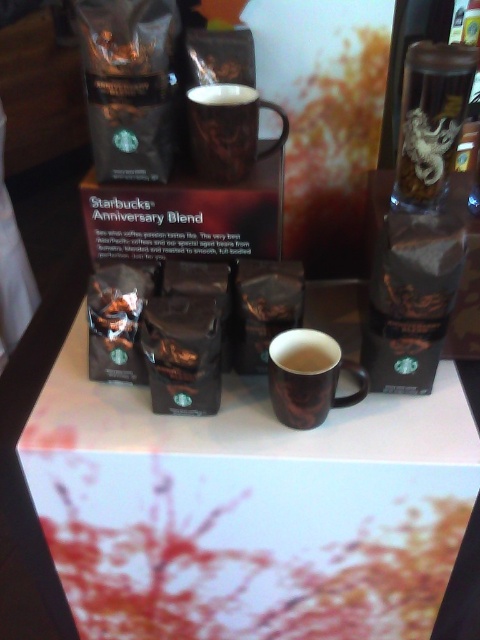
Question: Is brown matte mug at center closer to camera compared to brown glossy mug at center?

Choices:
 (A) no
 (B) yes

Answer: (B)

Question: Which point is closer to the camera?

Choices:
 (A) (286, 332)
 (B) (248, 147)

Answer: (A)

Question: Which point is closer to the camera?

Choices:
 (A) (294, 349)
 (B) (463, 104)
 (C) (203, 173)
 (D) (357, 397)

Answer: (B)

Question: Which object appears closest to the camera in this image?

Choices:
 (A) brown matte mug at center
 (B) brown glossy mug at upper center

Answer: (A)

Question: Can you confirm if transparent glass at upper right is bigger than brown glossy mug at upper center?

Choices:
 (A) no
 (B) yes

Answer: (B)

Question: Does white glossy table at center appear over brown glossy mug at upper center?

Choices:
 (A) no
 (B) yes

Answer: (A)